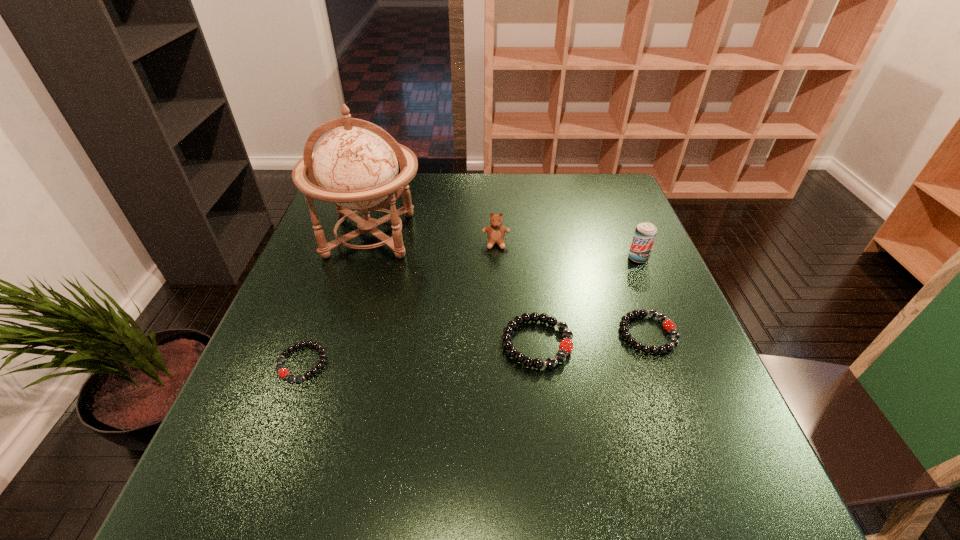
You are a GUI agent. You are given a task and a screenshot of the screen. Output one action in this format:
    pyautogui.click(x=<x>, y=<y>)
    Task: Click on the unoccupied area between the second shortest bracelet and the second bracelet from right to left
    The image size is (960, 540).
    Given the screenshot: What is the action you would take?
    (x=592, y=339)

Locate an element on the screen. This screenshot has height=540, width=960. empty space that is in between the fourth tallest object and the leftmost bracelet is located at coordinates (x=420, y=354).

What are the coordinates of `free space between the shortest bracelet and the teddy bear` in the screenshot? It's located at (399, 303).

In order to click on free area in between the beer can and the shortest object in this screenshot , I will do click(x=470, y=311).

The width and height of the screenshot is (960, 540). I want to click on free space between the second bracelet from left to right and the beer can, so click(x=588, y=301).

This screenshot has height=540, width=960. I want to click on object that ranks as the fifth closest to the teddy bear, so click(283, 372).

At what (x,y) coordinates should I click in order to perform the action: click on the second closest object to the second tallest bracelet. Please return your answer as a coordinate pair (x, y). Looking at the image, I should click on coord(645,233).

Where is `bracelet that is the second nearest to the second shortest bracelet`? The width and height of the screenshot is (960, 540). bracelet that is the second nearest to the second shortest bracelet is located at coordinates (283, 372).

This screenshot has width=960, height=540. In order to click on the second closest bracelet to the fifth tallest object in this screenshot , I will do `click(283, 372)`.

Image resolution: width=960 pixels, height=540 pixels. What are the coordinates of `vacant space that satisfies the following two spatial constraints: 1. on the back side of the second bracelet from right to left; 2. on the right side of the leftmost bracelet` in the screenshot? It's located at (310, 343).